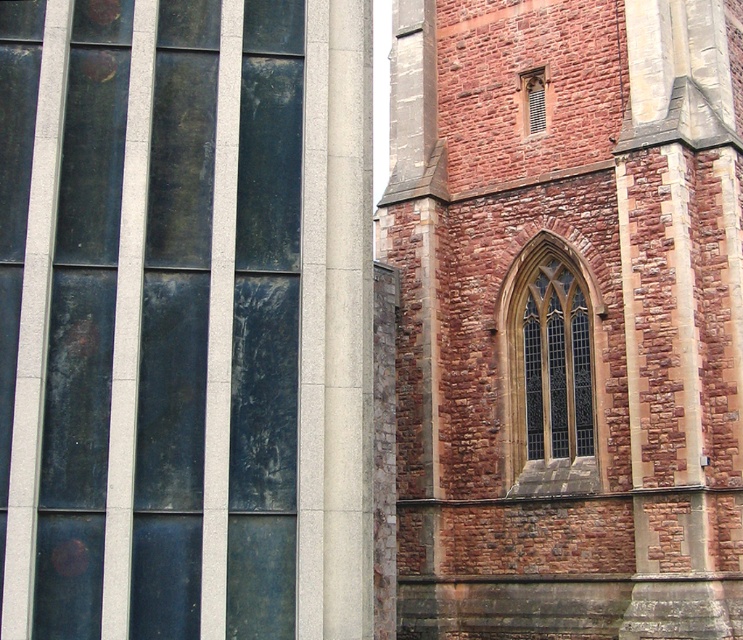
Is reddish-brown stone tower at center-right in front of matte brick window at upper right?

Yes.

Who is more distant from viewer, (435, 310) or (522, 81)?

Positioned behind is point (522, 81).

I want to click on reddish-brown stone tower at center-right, so click(x=567, y=317).

Does point (545, 202) come behind point (588, 376)?

Yes, it is.

Who is higher up, reddish-brown stone tower at center-right or stained glass window at center?

reddish-brown stone tower at center-right

What do you see at coordinates (567, 317) in the screenshot? I see `reddish-brown stone tower at center-right` at bounding box center [567, 317].

Locate an element on the screen. Image resolution: width=743 pixels, height=640 pixels. reddish-brown stone tower at center-right is located at coordinates (567, 317).

Does stained glass window at center have a smaller size compared to matte brick window at upper right?

Incorrect, stained glass window at center is not smaller in size than matte brick window at upper right.

Does point (580, 288) come closer to viewer compared to point (533, 90)?

Yes, it is.

Where is `stained glass window at center`? stained glass window at center is located at coordinates coord(551,376).